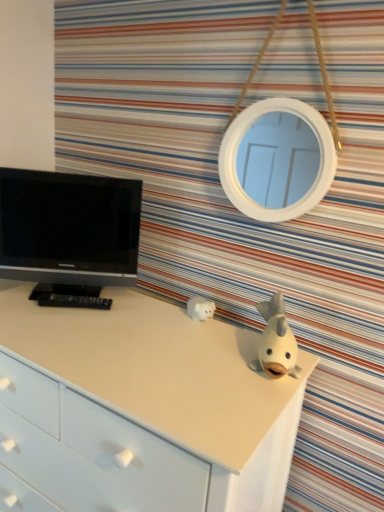
At what (x,y) coordinates should I click in order to perform the action: click on free spot in front of white matte fish at upper right, the 2th toy from the back. Please return your answer as a coordinate pair (x, y). The height and width of the screenshot is (512, 384). Looking at the image, I should click on (248, 406).